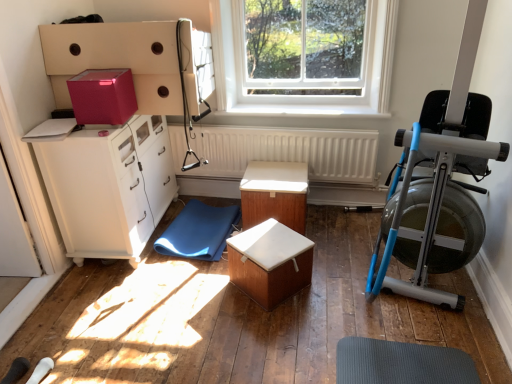
Find the location of `blue rubber yoga mat at lower center`. blue rubber yoga mat at lower center is located at coordinates (198, 231).

What do you see at coordinates (281, 151) in the screenshot? This screenshot has width=512, height=384. I see `white matte radiator at center` at bounding box center [281, 151].

Locate an element on the screen. The height and width of the screenshot is (384, 512). transparent glass window at upper center is located at coordinates (303, 75).

From the picture: Measure the distance between wooden table at center, placed as the second table when sorted from front to back, and camera.

wooden table at center, placed as the second table when sorted from front to back, is 8.97 feet from camera.

This screenshot has height=384, width=512. Identify the location of white smooth window sill at center. (305, 111).

Does transparent glass window at upper center turn towards pink matte cardboard box at upper left?

Yes.

From a real-world perspective, does transparent glass window at upper center sit lower than pink matte cardboard box at upper left?

Actually, transparent glass window at upper center is physically above pink matte cardboard box at upper left in the real world.

From the picture: Which object is closer to the camera, transparent glass window at upper center or pink matte cardboard box at upper left?

pink matte cardboard box at upper left is more forward.

How different are the orientations of transparent glass window at upper center and pink matte cardboard box at upper left in degrees?

They differ by 0.104 degrees in their facing directions.

Are pink matte cardboard box at upper left and transparent glass window at upper center located far from each other?

pink matte cardboard box at upper left is far away from transparent glass window at upper center.

Considering the relative positions of pink matte cardboard box at upper left and transparent glass window at upper center in the image provided, is pink matte cardboard box at upper left behind transparent glass window at upper center?

No, the depth of pink matte cardboard box at upper left is less than that of transparent glass window at upper center.

Is pink matte cardboard box at upper left to the right of transparent glass window at upper center from the viewer's perspective?

No, pink matte cardboard box at upper left is not to the right of transparent glass window at upper center.

Can you confirm if pink matte cardboard box at upper left is bigger than transparent glass window at upper center?

Actually, pink matte cardboard box at upper left might be smaller than transparent glass window at upper center.

Relative to white matte radiator at center, is blue rubber yoga mat at lower center in front or behind?

Clearly, blue rubber yoga mat at lower center is in front of white matte radiator at center.

Locate an element on the screen. radiator that is above the blue rubber yoga mat at lower center (from the image's perspective) is located at coordinates (281, 151).

Does blue rubber yoga mat at lower center have a greater height compared to white matte radiator at center?

In fact, blue rubber yoga mat at lower center may be shorter than white matte radiator at center.

Is blue rubber yoga mat at lower center directly adjacent to white matte radiator at center?

No, blue rubber yoga mat at lower center is not with white matte radiator at center.

Is pink matte cardboard box at upper left in front of or behind white smooth window sill at center in the image?

Visually, pink matte cardboard box at upper left is located in front of white smooth window sill at center.

From the picture: From the image's perspective, is pink matte cardboard box at upper left on top of white smooth window sill at center?

No, from the image's perspective, pink matte cardboard box at upper left is not on top of white smooth window sill at center.

Considering the sizes of pink matte cardboard box at upper left and white smooth window sill at center in the image, is pink matte cardboard box at upper left wider or thinner than white smooth window sill at center?

→ pink matte cardboard box at upper left is wider than white smooth window sill at center.

Is matte white cabinet at left placed right next to white smooth window sill at center?

No, matte white cabinet at left is not touching white smooth window sill at center.

How much distance is there between matte white cabinet at left and white smooth window sill at center?

matte white cabinet at left is 1.01 meters from white smooth window sill at center.

Consider the image. From the image's perspective, between matte white cabinet at left and white smooth window sill at center, which one is located above?

From the image's view, white smooth window sill at center is above.

How different are the orientations of matte white cabinet at left and white smooth window sill at center in degrees?

matte white cabinet at left and white smooth window sill at center are facing 91.6 degrees away from each other.

Is blue metallic rowing machine at right looking in the opposite direction of white smooth window sill at center?

No, white smooth window sill at center is not at the back of blue metallic rowing machine at right.

Is blue metallic rowing machine at right shorter than white smooth window sill at center?

Incorrect, the height of blue metallic rowing machine at right does not fall short of that of white smooth window sill at center.

Considering the sizes of objects blue metallic rowing machine at right and white smooth window sill at center in the image provided, who is thinner, blue metallic rowing machine at right or white smooth window sill at center?

Thinner between the two is white smooth window sill at center.

Which is behind, white smooth window sill at center or blue rubber yoga mat at lower center?

white smooth window sill at center.

Is white smooth window sill at center turned away from blue rubber yoga mat at lower center?

That's not correct — white smooth window sill at center is not looking away from blue rubber yoga mat at lower center.

How different are the orientations of white smooth window sill at center and blue rubber yoga mat at lower center in degrees?

white smooth window sill at center and blue rubber yoga mat at lower center are facing 5.75 degrees away from each other.

Can blue rubber yoga mat at lower center be found inside white smooth window sill at center?

No, blue rubber yoga mat at lower center is not surrounded by white smooth window sill at center.

You are a GUI agent. You are given a task and a screenshot of the screen. Output one action in this format:
    pyautogui.click(x=<x>, y=<y>)
    Task: Click on the cardboard box below the transparent glass window at upper center (from a real-world perspective)
    
    Given the screenshot: What is the action you would take?
    pyautogui.click(x=103, y=96)

Locate an element on the screen. cardboard box on the left of transparent glass window at upper center is located at coordinates (103, 96).

From the image, which object appears to be farther from wooden table at center, placed as the second table when sorted from front to back, wooden box at center, the first table viewed from the front, or white matte radiator at center?

The object further to wooden table at center, placed as the second table when sorted from front to back, is wooden box at center, the first table viewed from the front.

Estimate the real-world distances between objects in this image. Which object is closer to wooden box at center, marked as the second table in a back-to-front arrangement, pink matte cardboard box at upper left or blue rubber yoga mat at lower center?

The object closer to wooden box at center, marked as the second table in a back-to-front arrangement, is blue rubber yoga mat at lower center.

From the image, which object appears to be nearer to blue metallic rowing machine at right, pink matte cardboard box at upper left or wooden box at center, marked as the second table in a back-to-front arrangement?

Based on the image, wooden box at center, marked as the second table in a back-to-front arrangement, appears to be nearer to blue metallic rowing machine at right.

Based on their spatial positions, is transparent glass window at upper center or white smooth window sill at center further from wooden box at center, marked as the second table in a back-to-front arrangement?

transparent glass window at upper center.

Based on their spatial positions, is transparent glass window at upper center or blue rubber yoga mat at lower center closer to blue metallic rowing machine at right?

Based on the image, transparent glass window at upper center appears to be nearer to blue metallic rowing machine at right.

When comparing their distances from white matte radiator at center, does white smooth window sill at center or wooden table at center, arranged as the 1th table when viewed from the back, seem closer?

The object closer to white matte radiator at center is white smooth window sill at center.

Looking at the image, which one is located further to pink matte cardboard box at upper left, transparent glass window at upper center or blue metallic rowing machine at right?

blue metallic rowing machine at right.

Estimate the real-world distances between objects in this image. Which object is further from blue rubber yoga mat at lower center, white smooth window sill at center or blue metallic rowing machine at right?

blue metallic rowing machine at right lies further to blue rubber yoga mat at lower center than the other object.

Identify the location of window sill between matte white cabinet at left and blue metallic rowing machine at right in the horizontal direction. (305, 111).

Where is `table between white smooth window sill at center and wooden box at center, the first table viewed from the front, from top to bottom`? The image size is (512, 384). table between white smooth window sill at center and wooden box at center, the first table viewed from the front, from top to bottom is located at coordinates (275, 194).

The width and height of the screenshot is (512, 384). I want to click on yoga mat located between pink matte cardboard box at upper left and white matte radiator at center in the left-right direction, so click(x=198, y=231).

What are the coordinates of `yoga mat between matte white cabinet at left and white smooth window sill at center from left to right` in the screenshot? It's located at pyautogui.click(x=198, y=231).